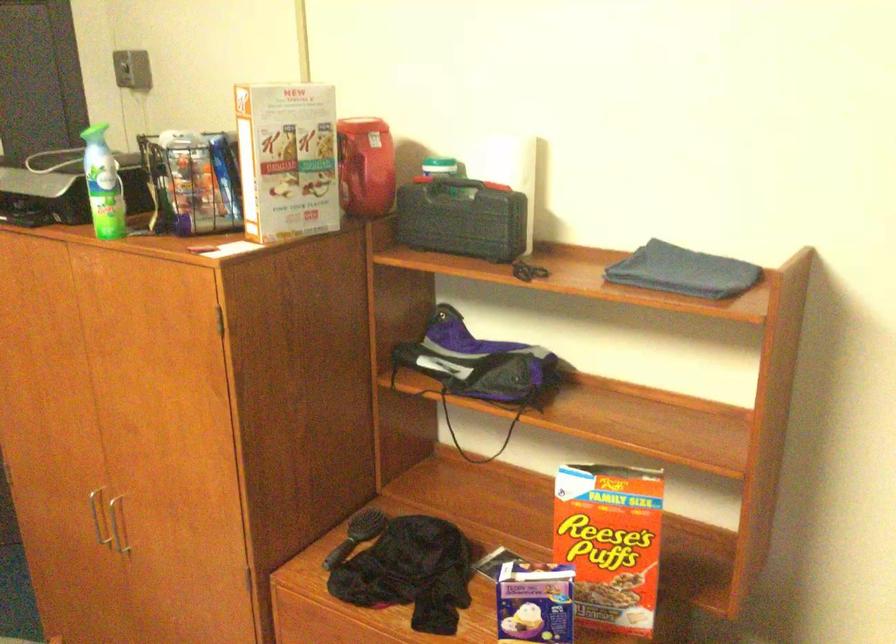
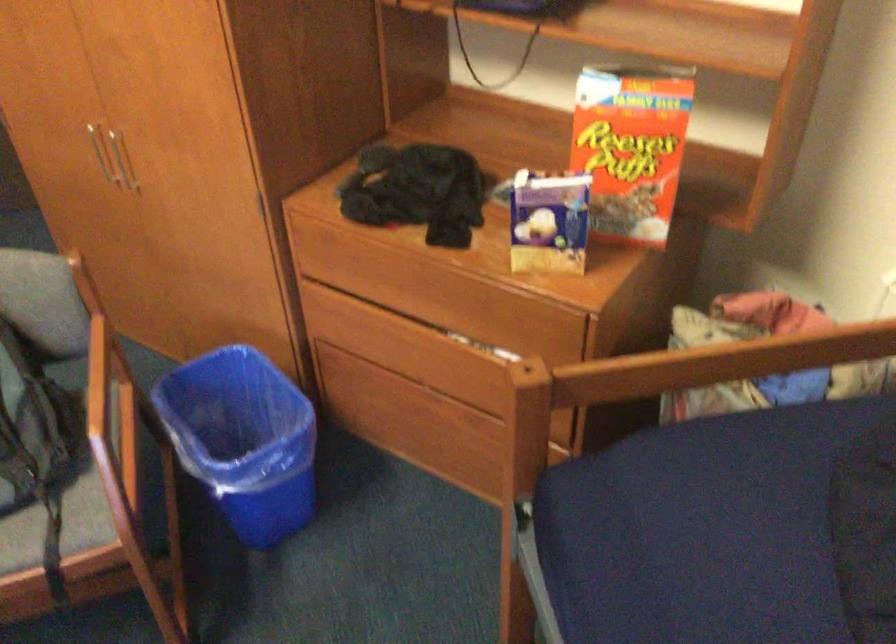
Locate, in the second image, the point that corresponds to point 95,513 in the first image.

(97, 149)